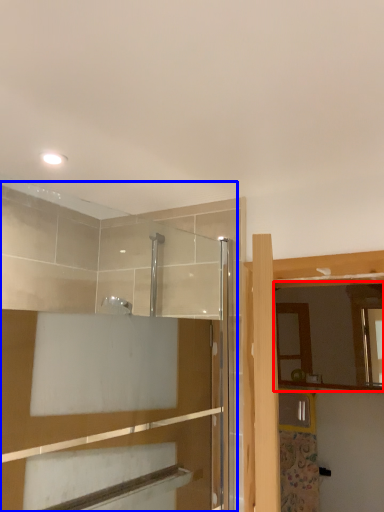
Question: Among these objects, which one is farthest to the camera, mirror (highlighted by a red box) or screen door (highlighted by a blue box)?

Choices:
 (A) mirror
 (B) screen door

Answer: (A)